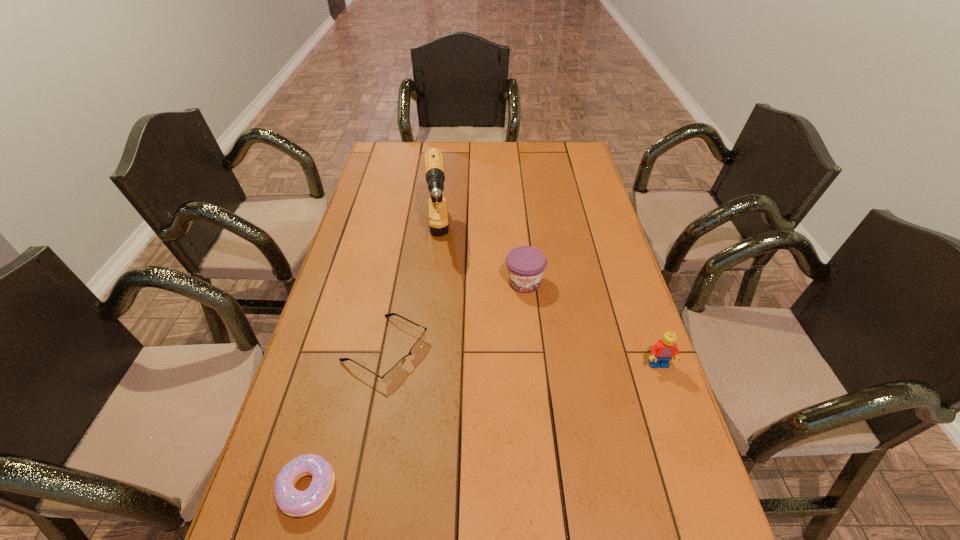
Locate an element on the screen. The image size is (960, 540). the nearest object is located at coordinates (292, 502).

At what (x,y) coordinates should I click in order to perform the action: click on the fourth shortest object. Please return your answer as a coordinate pair (x, y). The image size is (960, 540). Looking at the image, I should click on (663, 351).

Locate an element on the screen. This screenshot has height=540, width=960. Lego is located at coordinates (663, 351).

In order to click on the tallest object in this screenshot , I will do `click(434, 169)`.

The width and height of the screenshot is (960, 540). I want to click on the third shortest object, so click(x=525, y=264).

Locate an element on the screen. The height and width of the screenshot is (540, 960). jam is located at coordinates tap(525, 264).

Where is `spectacles`? The height and width of the screenshot is (540, 960). spectacles is located at coordinates [x=394, y=371].

What are the coordinates of `vacant space located 0.270m on the right of the nearest object` in the screenshot? It's located at (467, 489).

Image resolution: width=960 pixels, height=540 pixels. I want to click on free space located 0.360m on the face of the fourth shortest object, so click(716, 531).

What are the coordinates of `vacant region located 0.210m at the tip of the tallest object` in the screenshot? It's located at (438, 323).